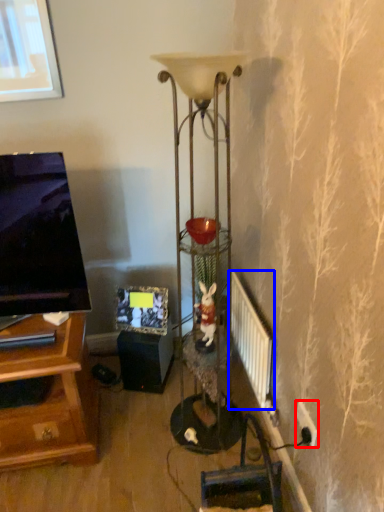
Question: Among these objects, which one is nearest to the camera, electric outlet (highlighted by a red box) or radiator (highlighted by a blue box)?

Choices:
 (A) electric outlet
 (B) radiator

Answer: (A)